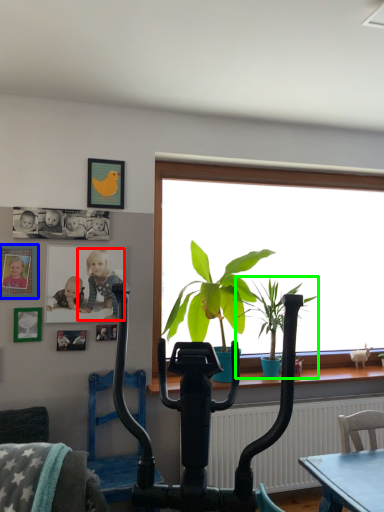
Question: Considering the real-world distances, which object is closest to person (highlighted by a red box)? picture frame (highlighted by a blue box) or houseplant (highlighted by a green box).

Choices:
 (A) picture frame
 (B) houseplant

Answer: (A)